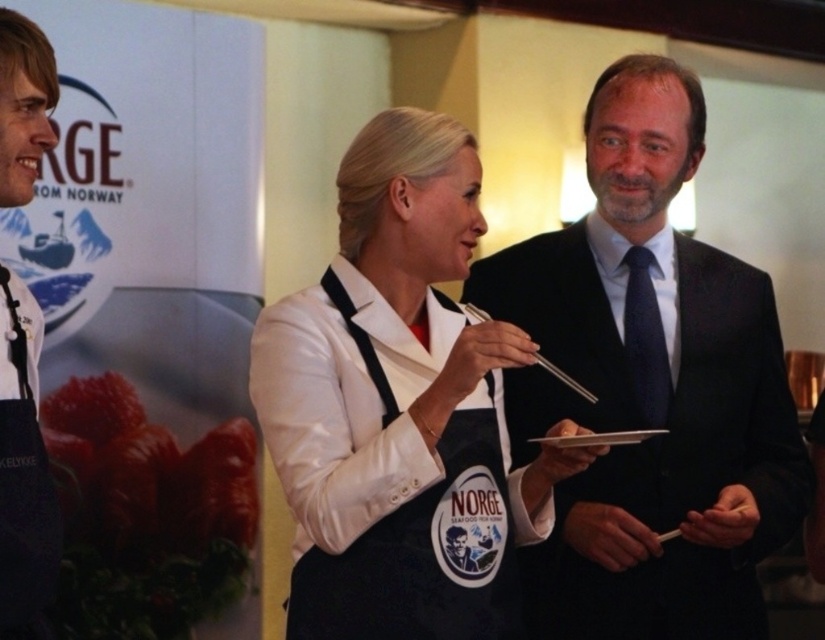
Which is below, dark suit at center or white satin apron at center?

Positioned lower is white satin apron at center.

Can you confirm if dark suit at center is positioned below white satin apron at center?

Incorrect, dark suit at center is not positioned below white satin apron at center.

Where is `dark suit at center`? This screenshot has width=825, height=640. dark suit at center is located at coordinates (649, 387).

Between white satin apron at center and black fabric apron at center, which one has less height?

black fabric apron at center

Does white satin apron at center come behind black fabric apron at center?

No, white satin apron at center is closer to the viewer.

Between point (399, 524) and point (328, 632), which one is positioned in front?

Point (328, 632)

Locate an element on the screen. white satin apron at center is located at coordinates (399, 408).

Who is positioned more to the left, black fabric apron at center or light brown leather jacket at left?

light brown leather jacket at left

Is black fabric apron at center positioned at the back of light brown leather jacket at left?

Yes, it is behind light brown leather jacket at left.

Find the location of a particular element. black fabric apron at center is located at coordinates (423, 556).